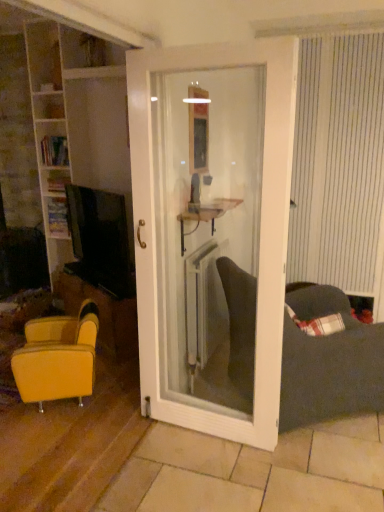
The height and width of the screenshot is (512, 384). I want to click on spots to the right of leather-like yellow armchair at lower left, so click(115, 398).